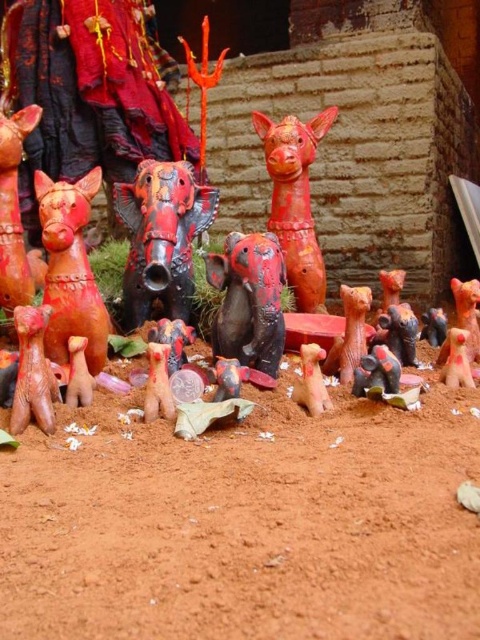
Question: Which of the following is the closest to the observer?

Choices:
 (A) (321, 378)
 (B) (264, 340)

Answer: (A)

Question: Which point appears farthest from the camera in this image?

Choices:
 (A) (24, 264)
 (B) (305, 352)
 (C) (292, 257)

Answer: (C)

Question: Does shiny red and black statue at center appear on the right side of matte red statue at center?

Choices:
 (A) no
 (B) yes

Answer: (A)

Question: Is matte black elephant at center wider than matte clay pig at center?

Choices:
 (A) yes
 (B) no

Answer: (A)

Question: Does shiny red and black statue at center appear on the left side of matte red statue at left?

Choices:
 (A) yes
 (B) no

Answer: (B)

Question: Which object is farther from the camera taking this photo?

Choices:
 (A) matte clay pig at center
 (B) matte red deer at lower left

Answer: (B)